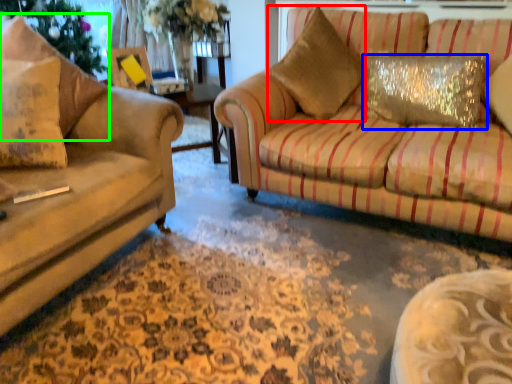
Question: Considering the real-world distances, which object is farthest from throw pillow (highlighted by a red box)? pillow (highlighted by a blue box) or pillow (highlighted by a green box)?

Choices:
 (A) pillow
 (B) pillow

Answer: (B)